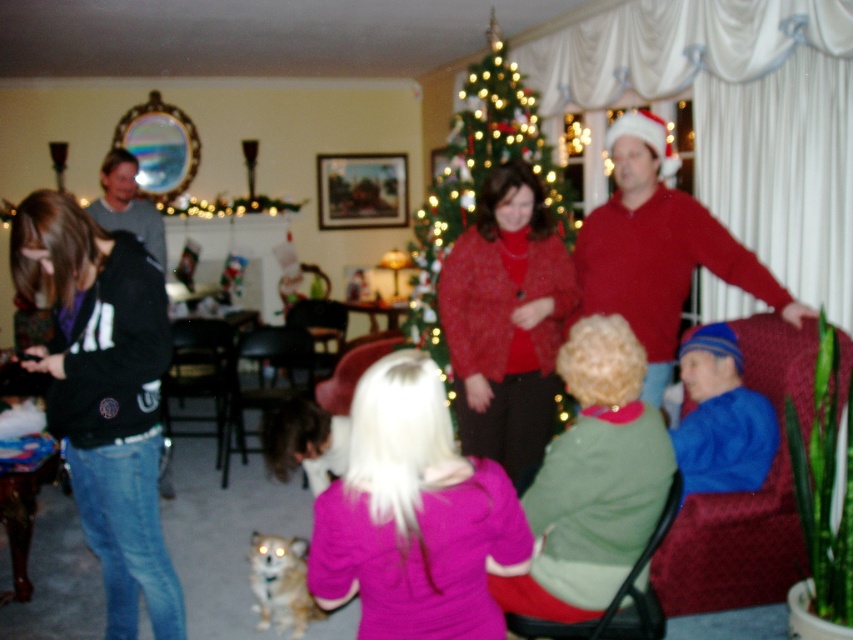
Question: In this image, where is maroon fabric armchair at lower right located relative to blue knit hat at right?

Choices:
 (A) left
 (B) right

Answer: (B)

Question: From the image, what is the correct spatial relationship of sparkly red sweater at center in relation to velvet burgundy armchair at center?

Choices:
 (A) below
 (B) above

Answer: (B)

Question: Which object appears closest to the camera in this image?

Choices:
 (A) golden fur dog at lower center
 (B) maroon fabric armchair at lower right
 (C) velvet burgundy armchair at center
 (D) sparkly red sweater at center

Answer: (B)

Question: Which object appears farthest from the camera in this image?

Choices:
 (A) green textured christmas tree at center
 (B) wooden armchair at center

Answer: (B)

Question: Does maroon fabric armchair at lower right lie in front of wooden armchair at center?

Choices:
 (A) no
 (B) yes

Answer: (B)

Question: Which object is farther from the camera taking this photo?

Choices:
 (A) wooden armchair at center
 (B) green textured christmas tree at center
 (C) blue knit hat at right
 (D) velvet burgundy armchair at center

Answer: (D)